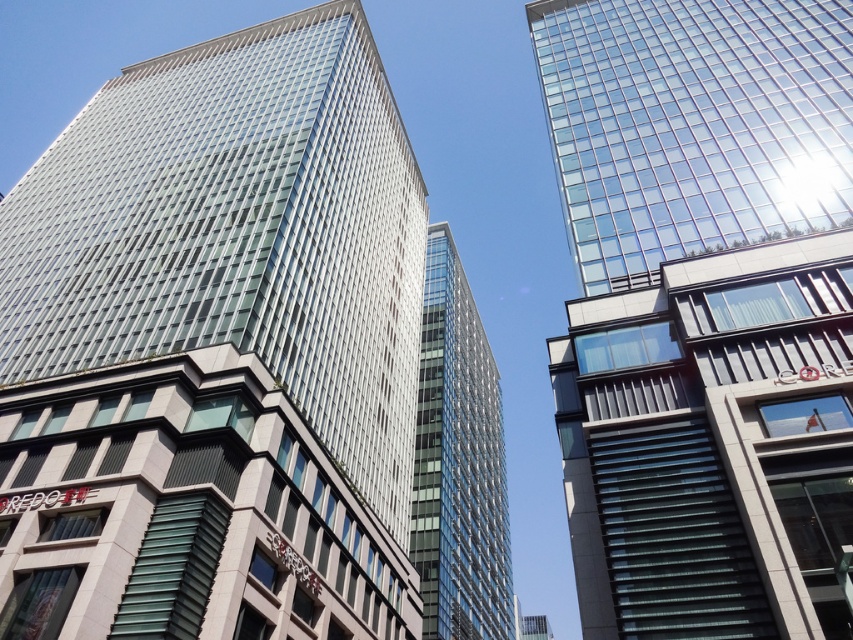
Is transparent glass building at center behind transparent glass tower at upper center?

Yes.

Which is behind, point (190, 266) or point (635, 278)?

The point (190, 266) is behind.

Locate an element on the screen. The height and width of the screenshot is (640, 853). transparent glass building at center is located at coordinates (216, 349).

Does transparent glass tower at upper center appear on the left side of transparent glass tower at center?

No, transparent glass tower at upper center is not to the left of transparent glass tower at center.

Can you confirm if transparent glass tower at upper center is shorter than transparent glass tower at center?

Indeed, transparent glass tower at upper center has a lesser height compared to transparent glass tower at center.

The height and width of the screenshot is (640, 853). Describe the element at coordinates (704, 310) in the screenshot. I see `transparent glass tower at upper center` at that location.

This screenshot has height=640, width=853. Find the location of `transparent glass tower at upper center`. transparent glass tower at upper center is located at coordinates (704, 310).

Can you confirm if transparent glass building at center is shorter than transparent glass tower at center?

Incorrect, transparent glass building at center's height does not fall short of transparent glass tower at center's.

Can you confirm if transparent glass building at center is positioned above transparent glass tower at center?

Correct, transparent glass building at center is located above transparent glass tower at center.

I want to click on transparent glass building at center, so click(216, 349).